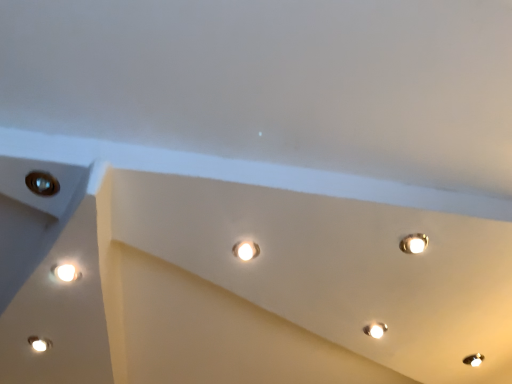
Question: Considering the relative positions of white glossy lamp at lower right, acting as the second lamp starting from the front, and metallic circular hole at upper left in the image provided, is white glossy lamp at lower right, acting as the second lamp starting from the front, to the right of metallic circular hole at upper left from the viewer's perspective?

Choices:
 (A) yes
 (B) no

Answer: (A)

Question: From the image's perspective, is white glossy lamp at lower right, the first lamp viewed from the right, below metallic circular hole at upper left?

Choices:
 (A) no
 (B) yes

Answer: (B)

Question: Is white glossy lamp at lower right, the 1th lamp positioned from the back, to the left of metallic circular hole at upper left from the viewer's perspective?

Choices:
 (A) yes
 (B) no

Answer: (B)

Question: From the image's perspective, would you say white glossy lamp at lower right, the 1th lamp positioned from the back, is positioned over metallic circular hole at upper left?

Choices:
 (A) no
 (B) yes

Answer: (A)

Question: Is white glossy lamp at lower right, acting as the second lamp starting from the front, not within metallic circular hole at upper left?

Choices:
 (A) yes
 (B) no

Answer: (A)

Question: Are white glossy lamp at lower right, the 2th lamp from the left, and metallic circular hole at upper left located far from each other?

Choices:
 (A) no
 (B) yes

Answer: (B)

Question: Can white glossy lamp at lower right, the 2th lamp from the left, be found inside matte white droplight at center?

Choices:
 (A) yes
 (B) no

Answer: (B)

Question: Can you confirm if matte white droplight at center is thinner than white glossy lamp at lower right, the first lamp viewed from the right?

Choices:
 (A) no
 (B) yes

Answer: (B)

Question: Is matte white droplight at center positioned with its back to white glossy lamp at lower right, the 2th lamp from the left?

Choices:
 (A) yes
 (B) no

Answer: (B)

Question: Can you confirm if matte white droplight at center is taller than white glossy lamp at lower right, the 2th lamp from the left?

Choices:
 (A) yes
 (B) no

Answer: (B)

Question: Is matte white droplight at center positioned in front of white glossy lamp at lower right, the 1th lamp positioned from the back?

Choices:
 (A) yes
 (B) no

Answer: (A)

Question: From a real-world perspective, is matte white droplight at center on top of white glossy lamp at lower right, acting as the second lamp starting from the front?

Choices:
 (A) no
 (B) yes

Answer: (B)

Question: Is matte white droplight at center positioned beyond the bounds of matte white lamp at lower left, acting as the 1th lamp starting from the front?

Choices:
 (A) yes
 (B) no

Answer: (A)